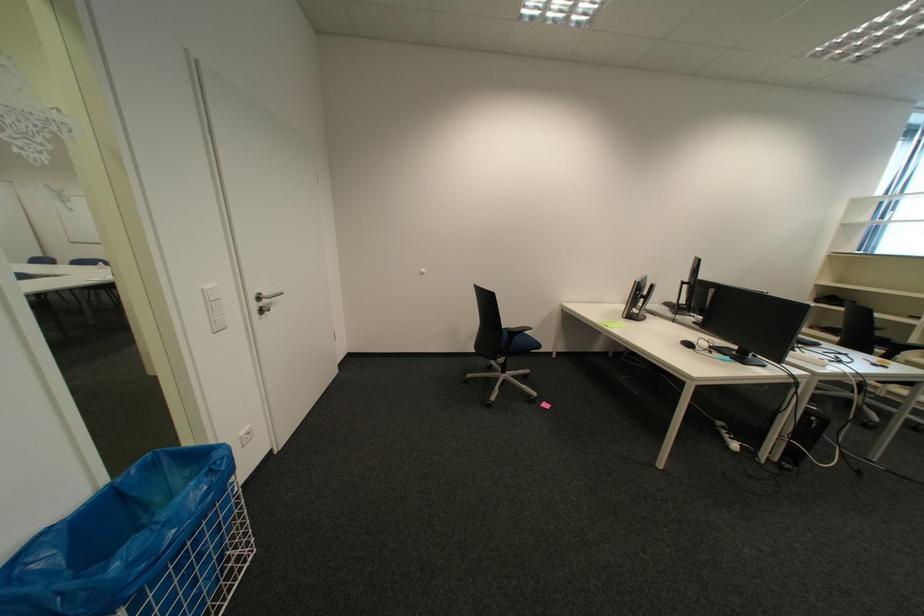
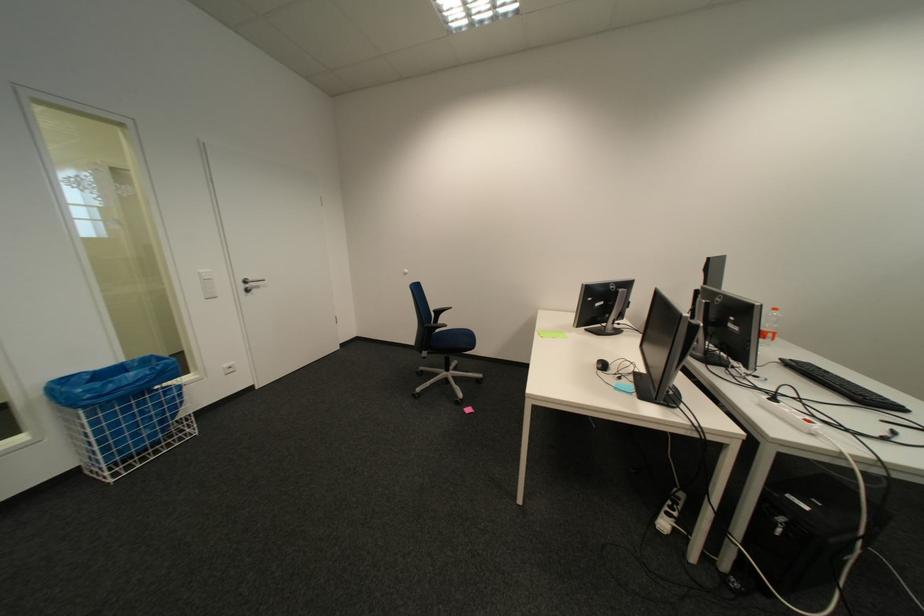
Question: The images are taken continuously from a first-person perspective. In which direction are you moving?

Choices:
 (A) Left
 (B) Right
 (C) Forward
 (D) Backward

Answer: (B)